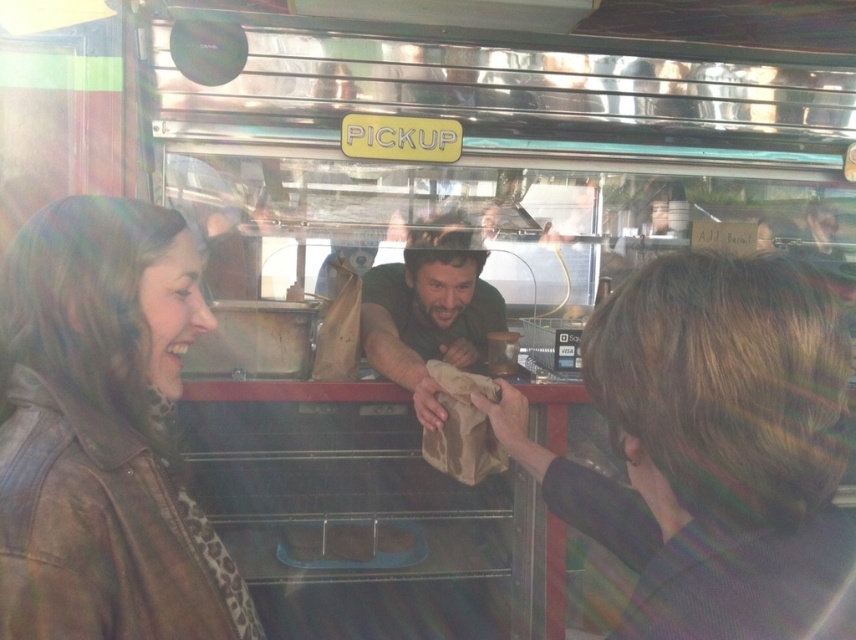
Question: Can you confirm if brown paper bag at center is thinner than brown leather jacket at left?

Choices:
 (A) yes
 (B) no

Answer: (B)

Question: Is brown leather jacket at left wider than green fabric shirt at center?

Choices:
 (A) no
 (B) yes

Answer: (A)

Question: Considering the real-world distances, which object is closest to the green fabric shirt at center?

Choices:
 (A) brown leather jacket at left
 (B) brown paper bag at center

Answer: (B)

Question: Which of the following is the closest to the observer?

Choices:
 (A) brown paper bag at center
 (B) brown leather jacket at left
 (C) green fabric shirt at center

Answer: (A)

Question: Which is farther from the brown leather jacket at left?

Choices:
 (A) brown paper bag at center
 (B) green fabric shirt at center

Answer: (B)

Question: Does brown paper bag at center have a smaller size compared to green fabric shirt at center?

Choices:
 (A) yes
 (B) no

Answer: (A)